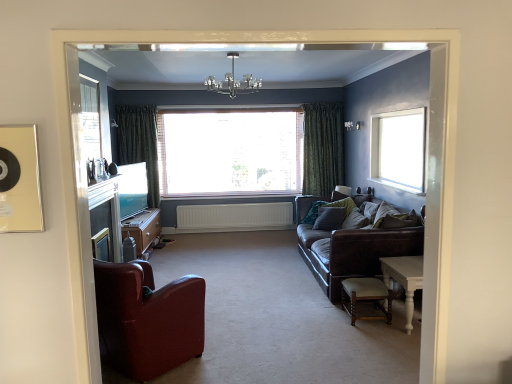
Question: Is clear glass window screen at upper left a part of white matte radiator at center?

Choices:
 (A) no
 (B) yes

Answer: (A)

Question: Is white matte radiator at center to the left of clear glass window screen at upper left from the viewer's perspective?

Choices:
 (A) yes
 (B) no

Answer: (B)

Question: From a real-world perspective, does white matte radiator at center sit lower than clear glass window screen at upper left?

Choices:
 (A) no
 (B) yes

Answer: (B)

Question: Does white matte radiator at center have a smaller size compared to clear glass window screen at upper left?

Choices:
 (A) no
 (B) yes

Answer: (A)

Question: Does white matte radiator at center lie behind clear glass window screen at upper left?

Choices:
 (A) yes
 (B) no

Answer: (A)

Question: From the image's perspective, relative to green textured curtain at center, the 2th curtain viewed from the left, is light beige leather stool at lower right above or below?

Choices:
 (A) below
 (B) above

Answer: (A)

Question: Would you say light beige leather stool at lower right is to the left or to the right of green textured curtain at center, the 2th curtain viewed from the left, in the picture?

Choices:
 (A) right
 (B) left

Answer: (B)

Question: Considering the positions of light beige leather stool at lower right and green textured curtain at center, the 2th curtain viewed from the left, in the image, is light beige leather stool at lower right wider or thinner than green textured curtain at center, the 2th curtain viewed from the left,?

Choices:
 (A) thin
 (B) wide

Answer: (B)

Question: From a real-world perspective, relative to green textured curtain at center, the 2th curtain viewed from the left, is light beige leather stool at lower right vertically above or below?

Choices:
 (A) above
 (B) below

Answer: (B)

Question: Considering the positions of clear glass window screen at upper left and transparent glass window at center, the 1th window positioned from the back, in the image, is clear glass window screen at upper left bigger or smaller than transparent glass window at center, the 1th window positioned from the back,?

Choices:
 (A) big
 (B) small

Answer: (B)

Question: Is clear glass window screen at upper left wider or thinner than transparent glass window at center, the second window from the right?

Choices:
 (A) thin
 (B) wide

Answer: (A)

Question: From the image's perspective, relative to transparent glass window at center, the second window from the right, is clear glass window screen at upper left above or below?

Choices:
 (A) above
 (B) below

Answer: (A)

Question: Considering their positions, is clear glass window screen at upper left located in front of or behind transparent glass window at center, the second window from the right?

Choices:
 (A) behind
 (B) front

Answer: (B)

Question: Is light beige leather stool at lower right in front of or behind clear glass window at upper right, positioned as the first window in front-to-back order, in the image?

Choices:
 (A) front
 (B) behind

Answer: (A)

Question: From a real-world perspective, relative to clear glass window at upper right, which is the first window in right-to-left order, is light beige leather stool at lower right vertically above or below?

Choices:
 (A) above
 (B) below

Answer: (B)